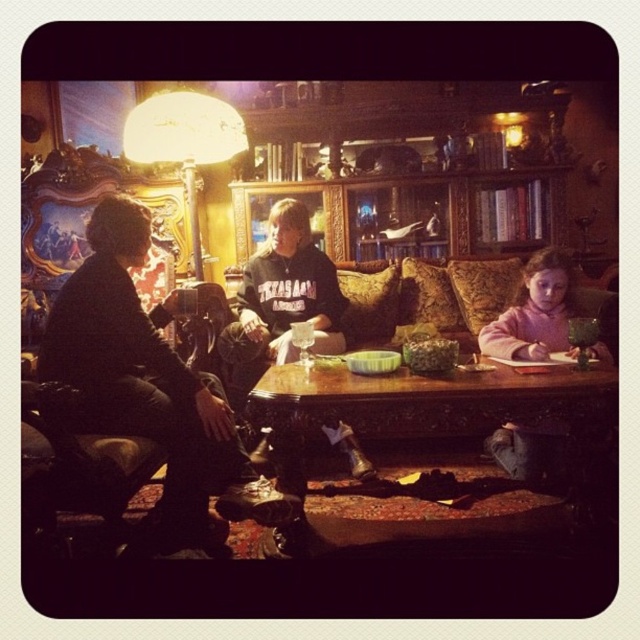
Question: Observing the image, what is the correct spatial positioning of dark brown leather jacket at left in reference to wooden table at center?

Choices:
 (A) right
 (B) left

Answer: (B)

Question: Does sweatshirt at center have a greater width compared to pink fleece sweater at lower right?

Choices:
 (A) yes
 (B) no

Answer: (A)

Question: Considering the real-world distances, which object is closest to the sweatshirt at center?

Choices:
 (A) dark brown leather jacket at left
 (B) pink fleece sweater at lower right
 (C) wooden table at center

Answer: (A)

Question: Is wooden table at center bigger than sweatshirt at center?

Choices:
 (A) no
 (B) yes

Answer: (B)

Question: Among these points, which one is farthest from the camera?

Choices:
 (A) (442, 420)
 (B) (109, 429)
 (C) (339, 285)

Answer: (C)

Question: Estimate the real-world distances between objects in this image. Which object is closer to the pink fleece sweater at lower right?

Choices:
 (A) wooden table at center
 (B) dark brown leather jacket at left
 (C) sweatshirt at center

Answer: (A)